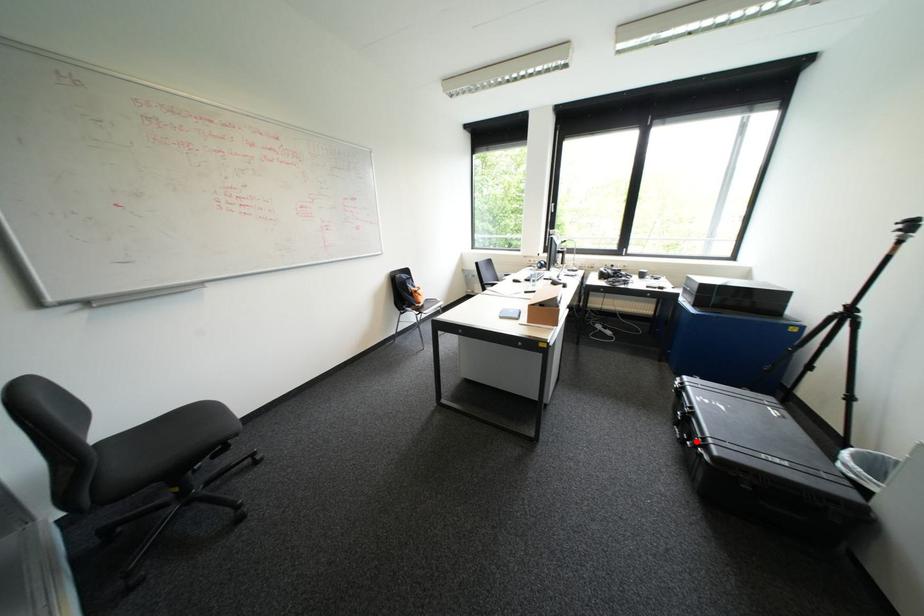
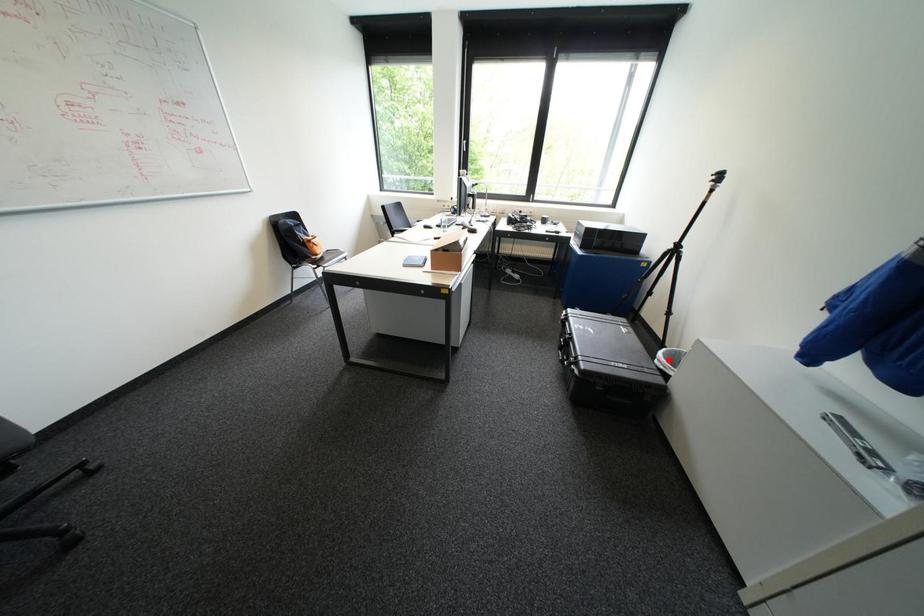
I am providing you with two images of the same scene from different viewpoints. A red point is marked on the first image and another point is marked on the second image. Is the marked point in image1 the same physical position as the marked point in image2?

No